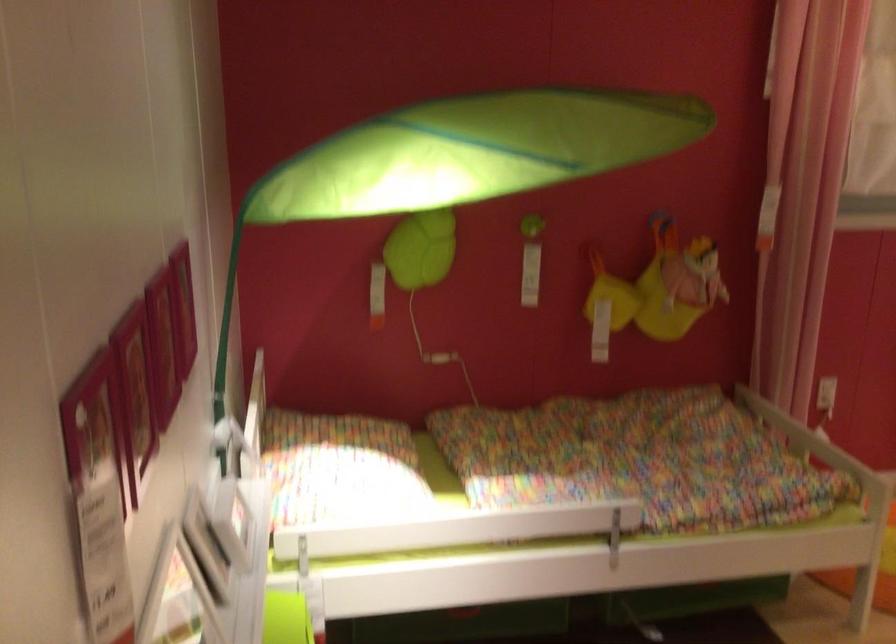
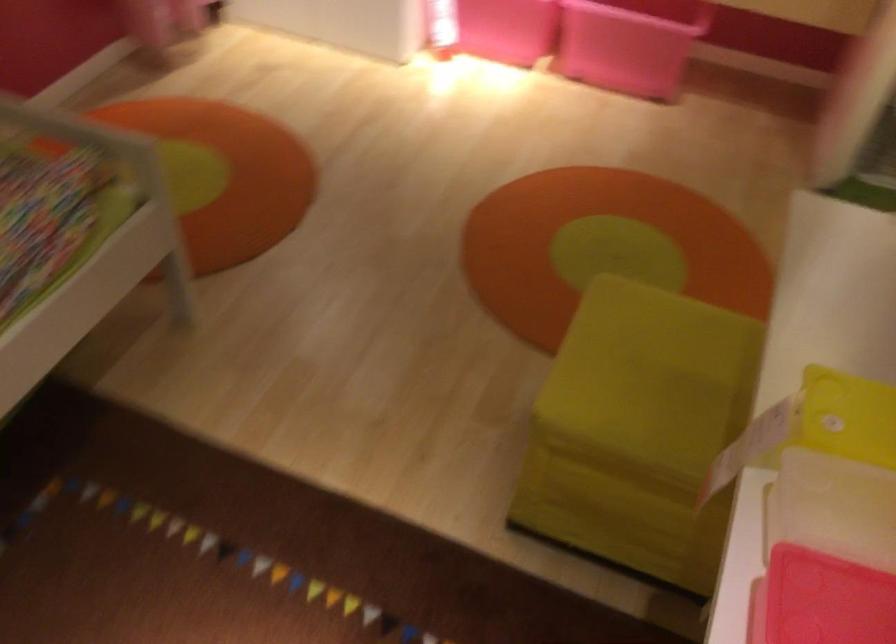
First-person continuous shooting, in which direction is the camera rotating?

The camera rotated toward right-down.